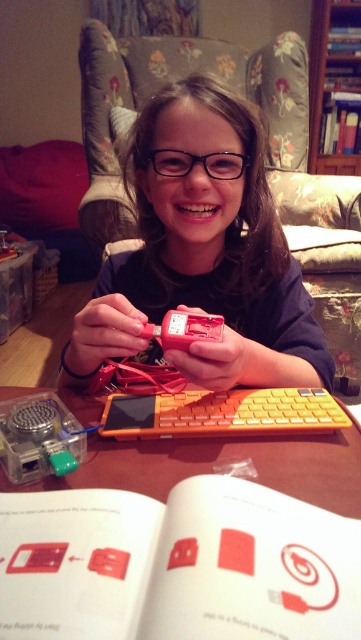
You are a person who wants to read the book on the table. You are standing behind the girl. Can you reach the white paper book at center without moving the orange plastic keyboard at center?

The white paper book at center is closer to the viewer than the orange plastic keyboard at center, so yes, you can reach the white paper book at center without moving the orange plastic keyboard at center since it is nearer to you.